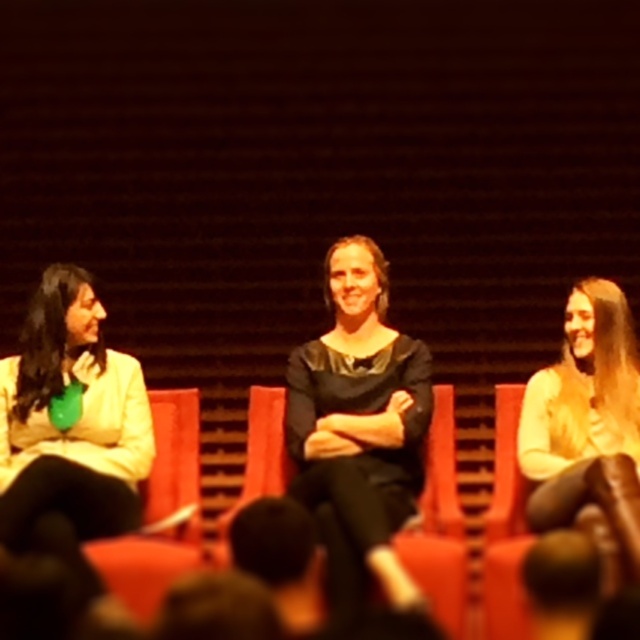
Who is more forward, (333, 436) or (598, 465)?

Point (598, 465)

Is point (349, 586) farther from camera compared to point (525, 449)?

No, (349, 586) is closer to viewer.

Locate an element on the screen. black matte dress at center is located at coordinates (358, 428).

Who is positioned more to the left, matte yellow jacket at left or smooth leather chair at center?

From the viewer's perspective, matte yellow jacket at left appears more on the left side.

The image size is (640, 640). I want to click on matte yellow jacket at left, so click(70, 417).

This screenshot has height=640, width=640. I want to click on matte yellow jacket at left, so click(70, 417).

Can you confirm if black matte dress at center is positioned to the right of matte yellow jacket at left?

Correct, you'll find black matte dress at center to the right of matte yellow jacket at left.

Who is more distant from viewer, (314, 444) or (36, 381)?

The point (314, 444) is behind.

What do you see at coordinates (358, 428) in the screenshot? I see `black matte dress at center` at bounding box center [358, 428].

The width and height of the screenshot is (640, 640). I want to click on black matte dress at center, so (x=358, y=428).